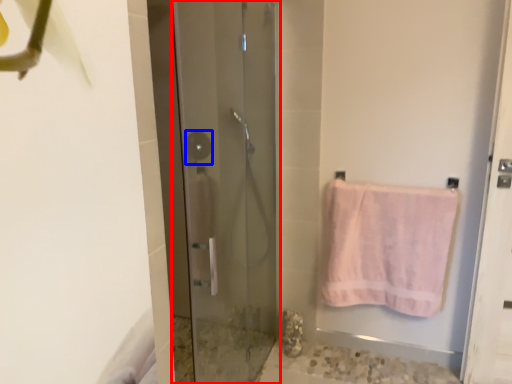
Question: Among these objects, which one is nearest to the camera, door (highlighted by a red box) or shower (highlighted by a blue box)?

Choices:
 (A) door
 (B) shower

Answer: (A)